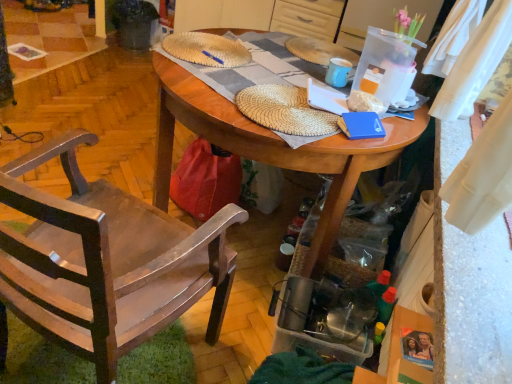
You are a GUI agent. You are given a task and a screenshot of the screen. Output one action in this format:
    pyautogui.click(x=<x>, y=<y>)
    Task: Click on the vacant region in front of woven straw hat at upper center, which is the first hat in top-to-bottom order
    
    Given the screenshot: What is the action you would take?
    pyautogui.click(x=215, y=77)